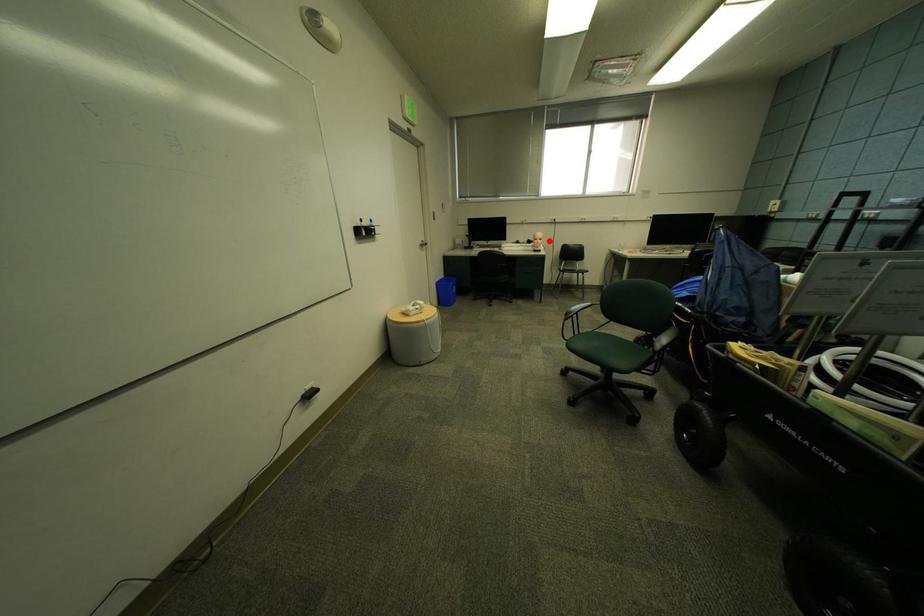
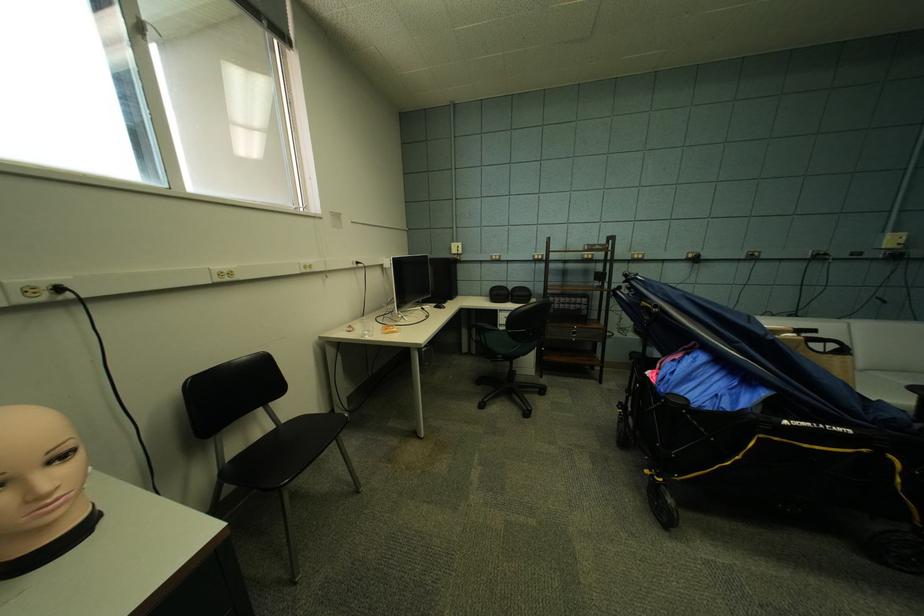
In the second image, find the point that corresponds to the highlighted location in the first image.

(70, 459)